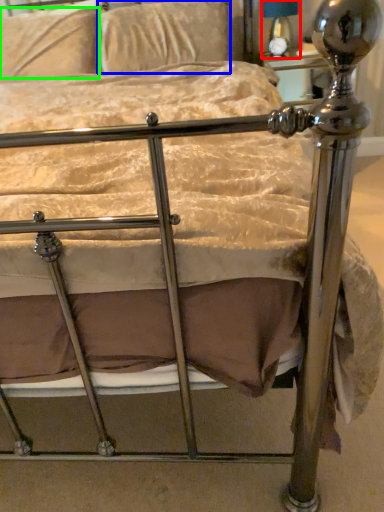
Question: Based on their relative distances, which object is nearer to table lamp (highlighted by a red box)? Choose from pillow (highlighted by a blue box) and pillow (highlighted by a green box).

Choices:
 (A) pillow
 (B) pillow

Answer: (A)